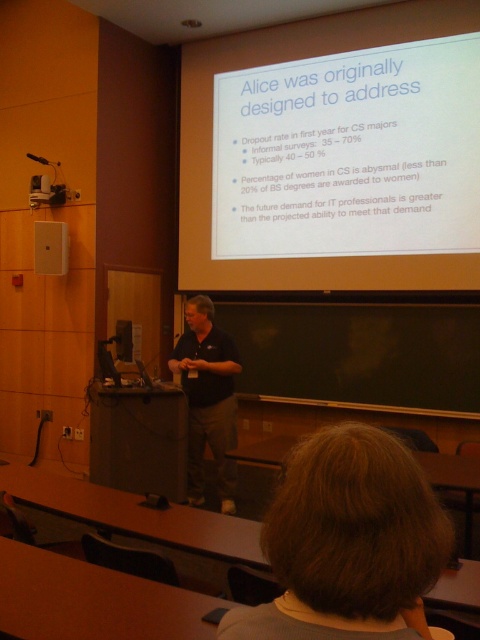
Question: Which point appears farthest from the camera in this image?

Choices:
 (A) (376, 536)
 (B) (282, 232)

Answer: (B)

Question: Does brown hair at upper center have a lesser width compared to dark blue shirt at center?

Choices:
 (A) yes
 (B) no

Answer: (A)

Question: Considering the real-world distances, which object is farthest from the dark blue shirt at center?

Choices:
 (A) brown hair at upper center
 (B) white matte projector screen at upper center

Answer: (A)

Question: Which object appears farthest from the camera in this image?

Choices:
 (A) brown hair at upper center
 (B) white matte projector screen at upper center
 (C) dark blue shirt at center

Answer: (B)

Question: Can you confirm if brown hair at upper center is wider than dark blue shirt at center?

Choices:
 (A) yes
 (B) no

Answer: (B)

Question: Does white matte projector screen at upper center have a lesser width compared to brown hair at upper center?

Choices:
 (A) no
 (B) yes

Answer: (A)